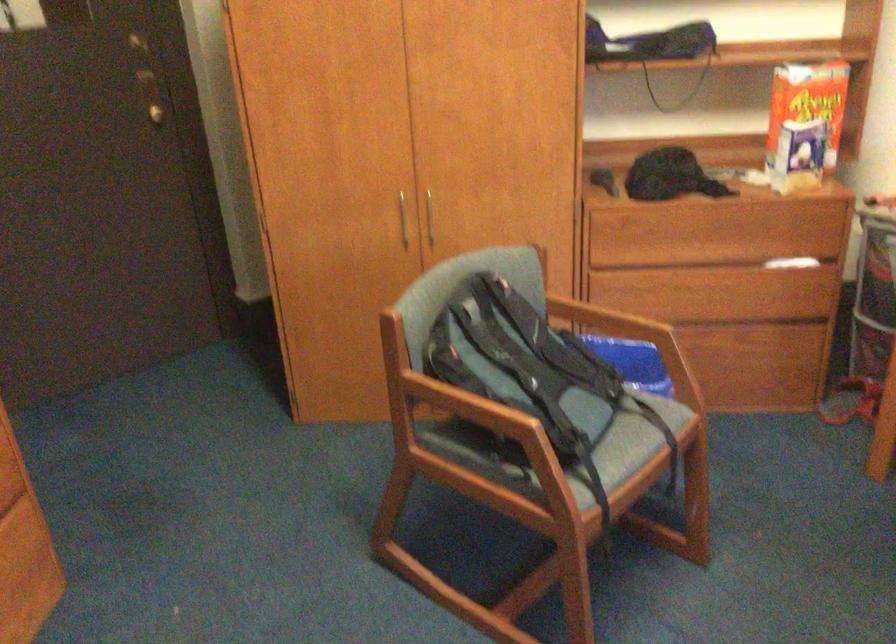
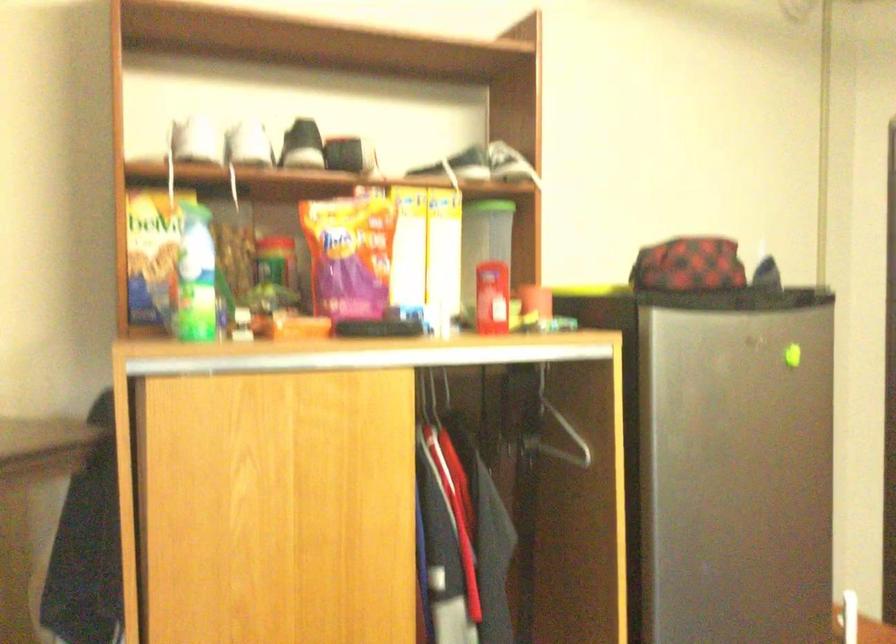
Question: The camera is either moving clockwise (left) or counter-clockwise (right) around the object. The first image is from the beginning of the video and the second image is from the end. Is the camera moving left or right when shooting the video?

Choices:
 (A) Left
 (B) Right

Answer: (B)